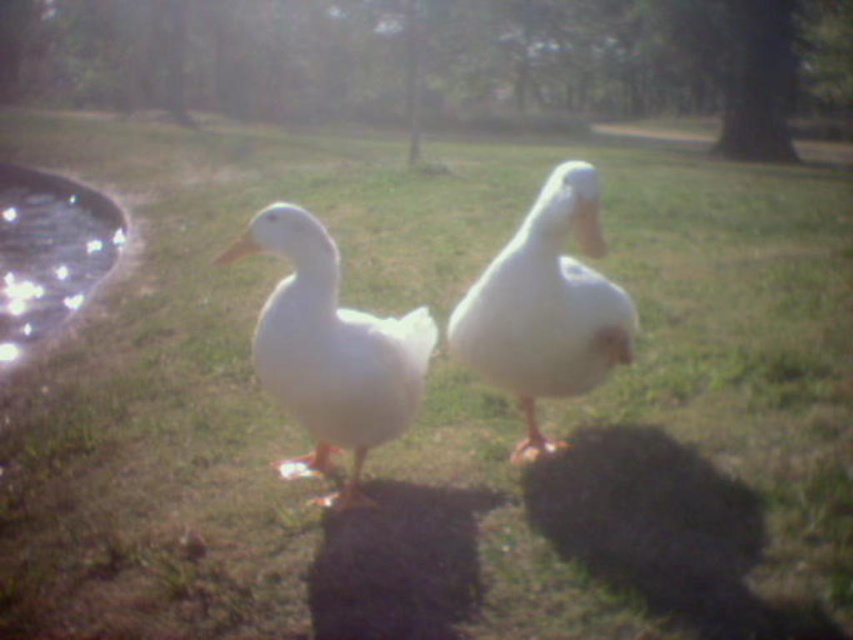
From the picture: You are a photographer trying to capture both the white matte duck at center and the glistening glass pond at left in a single frame. Based on their sizes, which object should you focus on first to ensure they both fit in the shot?

Since the white matte duck at center is smaller than the glistening glass pond at left, you should focus on the glistening glass pond at left first to ensure both fit in the shot.

You are a photographer trying to capture the white feathered duck at center and the glistening glass pond at left in a single shot. Based on their sizes, which object would appear smaller in the photo?

The white feathered duck at center would appear smaller in the photo because it is not as tall as the glistening glass pond at left.